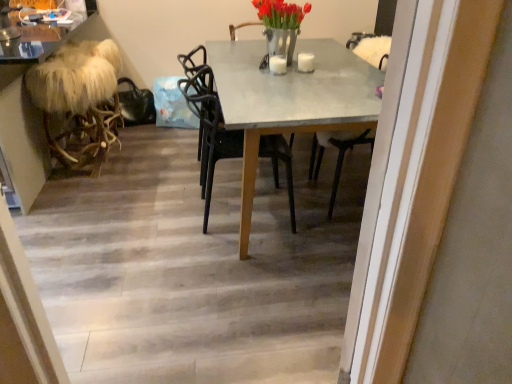
The height and width of the screenshot is (384, 512). Describe the element at coordinates (209, 129) in the screenshot. I see `black plastic chair at center` at that location.

Find the location of a particular element. The width and height of the screenshot is (512, 384). furry white stool at left is located at coordinates (79, 101).

This screenshot has width=512, height=384. What do you see at coordinates (281, 25) in the screenshot?
I see `metallic silver vase at upper center` at bounding box center [281, 25].

Measure the distance between point (234, 339) and camera.

5.61 feet.

Identify the location of black plastic chair at center. (209, 129).

Is point (26, 73) closer to viewer compared to point (375, 98)?

That is False.

How different are the orientations of furry white stool at left and concrete gray table at center in degrees?

The angle between the facing direction of furry white stool at left and the facing direction of concrete gray table at center is 0.92 degrees.

Measure the distance from furry white stool at left to concrete gray table at center.

furry white stool at left and concrete gray table at center are 1.09 meters apart.

Based on the photo, from the image's perspective, which is above, furry white stool at left or concrete gray table at center?

furry white stool at left, from the image's perspective.

Who is shorter, black plastic chair at center or metallic silver vase at upper center?

With less height is metallic silver vase at upper center.

From a real-world perspective, is black plastic chair at center beneath metallic silver vase at upper center?

Correct, in the physical world, black plastic chair at center is lower than metallic silver vase at upper center.

Which object is thinner, black plastic chair at center or metallic silver vase at upper center?

metallic silver vase at upper center is thinner.

From the picture: Are black plastic chair at center and metallic silver vase at upper center beside each other?

black plastic chair at center is not next to metallic silver vase at upper center, and they're not touching.

Between wooden floor at center and furry white stool at left, which one appears on the left side from the viewer's perspective?

From the viewer's perspective, furry white stool at left appears more on the left side.

From the image's perspective, which one is positioned higher, wooden floor at center or furry white stool at left?

furry white stool at left, from the image's perspective.

From a real-world perspective, is wooden floor at center positioned under furry white stool at left based on gravity?

Yes, from a real-world perspective, wooden floor at center is below furry white stool at left.

Who is taller, wooden floor at center or furry white stool at left?

Standing taller between the two is furry white stool at left.

Can you see concrete gray table at center touching furry white stool at left?

No, concrete gray table at center is not beside furry white stool at left.

Considering the sizes of objects concrete gray table at center and furry white stool at left in the image provided, who is taller, concrete gray table at center or furry white stool at left?

With more height is concrete gray table at center.

Which is in front, concrete gray table at center or furry white stool at left?

concrete gray table at center is more forward.

From the image's perspective, does concrete gray table at center appear higher than furry white stool at left?

Incorrect, from the image's perspective, concrete gray table at center is lower than furry white stool at left.

In the scene shown: Is metallic silver vase at upper center located outside wooden floor at center?

Indeed, metallic silver vase at upper center is completely outside wooden floor at center.

Looking at this image, can you tell me how much metallic silver vase at upper center and wooden floor at center differ in facing direction?

0.166 degrees separate the facing orientations of metallic silver vase at upper center and wooden floor at center.

This screenshot has height=384, width=512. Identify the location of floral arrangement that is above the wooden floor at center (from a real-world perspective). (281, 25).

Is metallic silver vase at upper center positioned behind wooden floor at center?

Yes, it is behind wooden floor at center.

Is concrete gray table at center positioned with its back to black plastic chair at center?

Absolutely, concrete gray table at center is directed away from black plastic chair at center.

Is concrete gray table at center to the left of black plastic chair at center from the viewer's perspective?

No, concrete gray table at center is not to the left of black plastic chair at center.

How distant is concrete gray table at center from black plastic chair at center?

concrete gray table at center and black plastic chair at center are 38.83 centimeters apart.

Is concrete gray table at center far from black plastic chair at center?

concrete gray table at center is actually quite close to black plastic chair at center.

Relative to concrete gray table at center, is metallic silver vase at upper center in front or behind?

metallic silver vase at upper center is behind concrete gray table at center.

Which is nearer, (279, 15) or (222, 87)?

The point (222, 87) is more forward.

From the image's perspective, which is below, metallic silver vase at upper center or concrete gray table at center?

concrete gray table at center, from the image's perspective.

From the picture: Considering the sizes of metallic silver vase at upper center and concrete gray table at center in the image, is metallic silver vase at upper center wider or thinner than concrete gray table at center?

Clearly, metallic silver vase at upper center has less width compared to concrete gray table at center.

Where is `rocking chair below the concrete gray table at center (from a real-world perspective)`? This screenshot has height=384, width=512. rocking chair below the concrete gray table at center (from a real-world perspective) is located at coordinates (79, 101).

You are a GUI agent. You are given a task and a screenshot of the screen. Output one action in this format:
    pyautogui.click(x=<x>, y=<y>)
    Task: Click on the floral arrangement above the black plastic chair at center (from a real-world perspective)
    The height and width of the screenshot is (384, 512).
    Given the screenshot: What is the action you would take?
    click(x=281, y=25)

Looking at the image, which one is located closer to concrete gray table at center, furry white stool at left or metallic silver vase at upper center?

metallic silver vase at upper center is positioned closer to the anchor concrete gray table at center.

Which object lies nearer to the anchor point concrete gray table at center, black plastic chair at center or metallic silver vase at upper center?

The object closer to concrete gray table at center is black plastic chair at center.

From the image, which object appears to be nearer to furry white stool at left, wooden floor at center or concrete gray table at center?

wooden floor at center lies closer to furry white stool at left than the other object.

Looking at this image, when comparing their distances from furry white stool at left, does black plastic chair at center or metallic silver vase at upper center seem closer?

The object closer to furry white stool at left is black plastic chair at center.

When comparing their distances from black plastic chair at center, does furry white stool at left or concrete gray table at center seem closer?

Among the two, concrete gray table at center is located nearer to black plastic chair at center.

Based on the photo, estimate the real-world distances between objects in this image. Which object is further from metallic silver vase at upper center, black plastic chair at center or furry white stool at left?

Based on the image, furry white stool at left appears to be further to metallic silver vase at upper center.

Looking at the image, which one is located closer to black plastic chair at center, concrete gray table at center or furry white stool at left?

concrete gray table at center is positioned closer to the anchor black plastic chair at center.

Based on the photo, estimate the real-world distances between objects in this image. Which object is further from black plastic chair at center, metallic silver vase at upper center or furry white stool at left?

furry white stool at left lies further to black plastic chair at center than the other object.

This screenshot has height=384, width=512. Identify the location of chair between furry white stool at left and metallic silver vase at upper center from left to right. (209, 129).

The width and height of the screenshot is (512, 384). I want to click on chair situated between furry white stool at left and concrete gray table at center from left to right, so click(x=209, y=129).

In order to click on kitchen & dining room table between metallic silver vase at upper center and wooden floor at center in the up-down direction in this screenshot , I will do (x=289, y=100).

This screenshot has width=512, height=384. Identify the location of stairwell between furry white stool at left and concrete gray table at center from left to right. [194, 267].